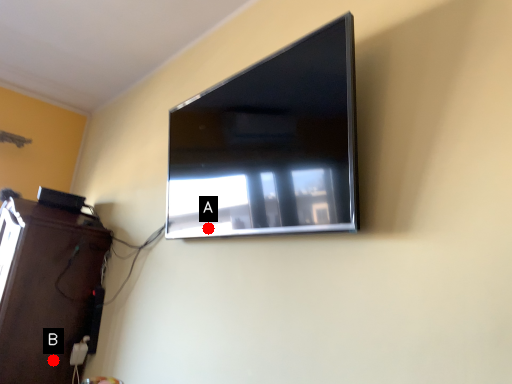
Question: Two points are circled on the image, labeled by A and B beside each circle. Which point is closer to the camera?

Choices:
 (A) A is closer
 (B) B is closer

Answer: (A)